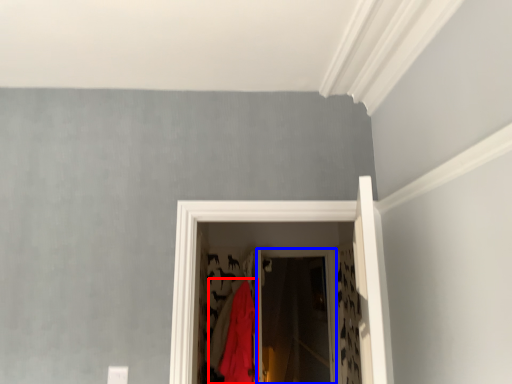
Question: Which object appears closest to the camera in this image, clothing (highlighted by a red box) or screen door (highlighted by a blue box)?

Choices:
 (A) clothing
 (B) screen door

Answer: (A)